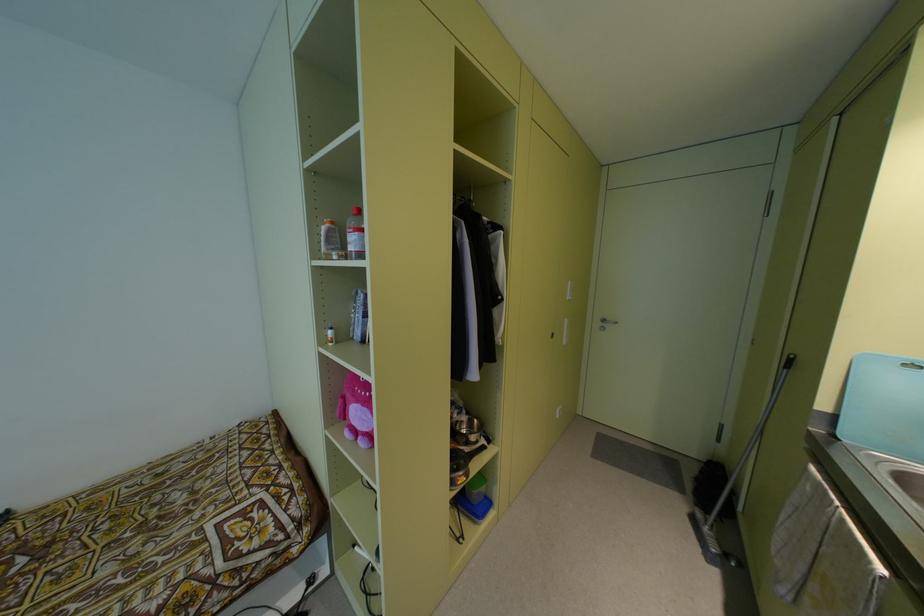
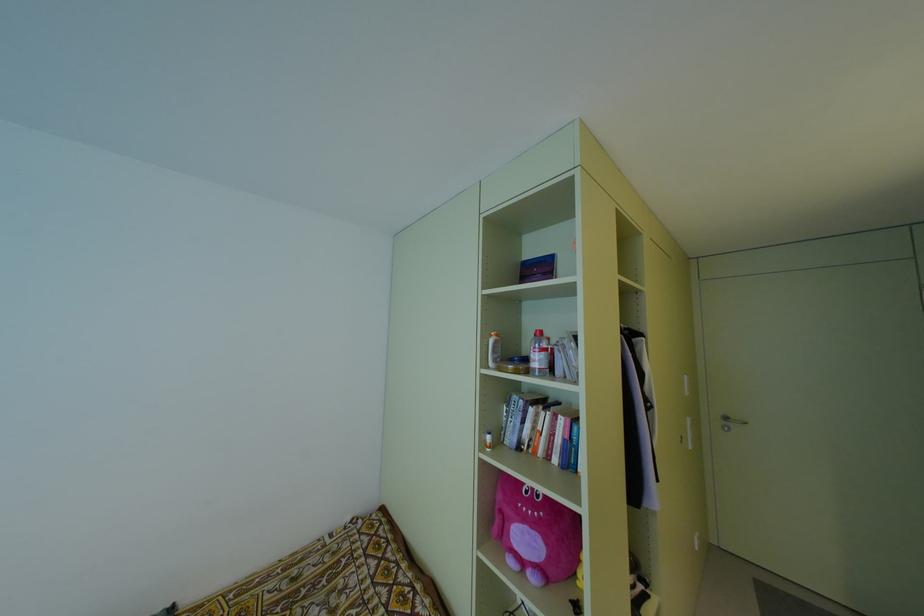
Question: How did the camera likely rotate?

Choices:
 (A) Left
 (B) Right
 (C) Up
 (D) Down

Answer: (C)